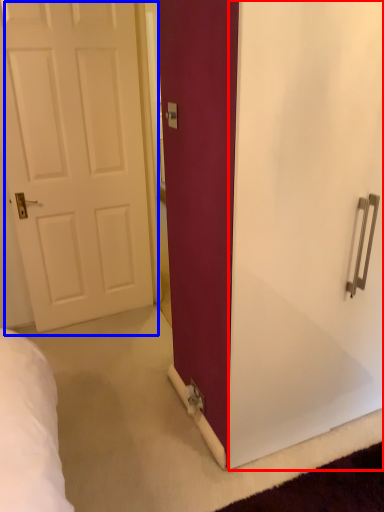
Question: Which point is closer to the camera, screen door (highlighted by a red box) or door (highlighted by a blue box)?

Choices:
 (A) screen door
 (B) door

Answer: (A)